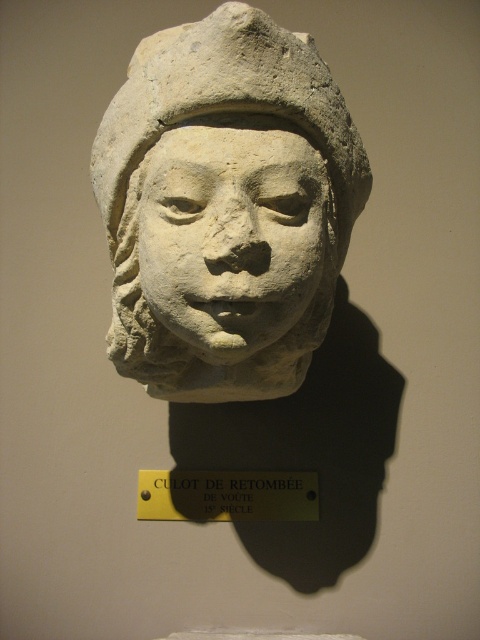
Question: Can you confirm if white stone bust at center is wider than stone face at center?

Choices:
 (A) yes
 (B) no

Answer: (A)

Question: Which object appears closest to the camera in this image?

Choices:
 (A) white stone bust at center
 (B) yellow metal sign at center
 (C) stone face at center

Answer: (A)

Question: Among these objects, which one is nearest to the camera?

Choices:
 (A) stone face at center
 (B) yellow metal sign at center

Answer: (A)

Question: Does white stone bust at center have a greater width compared to stone face at center?

Choices:
 (A) yes
 (B) no

Answer: (A)

Question: Estimate the real-world distances between objects in this image. Which object is farther from the white stone bust at center?

Choices:
 (A) yellow metal sign at center
 (B) stone face at center

Answer: (A)

Question: Is white stone bust at center smaller than yellow metal sign at center?

Choices:
 (A) yes
 (B) no

Answer: (B)